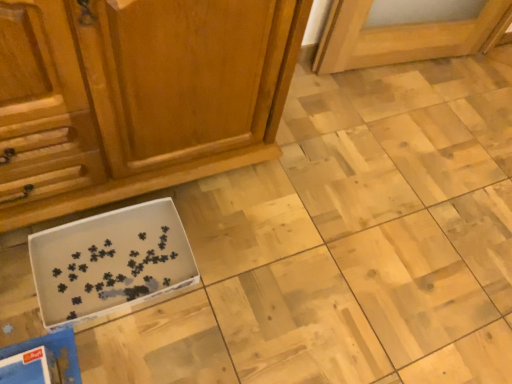
Question: Considering the positions of wooden cabinet at lower left and white cardboard box at lower left in the image, is wooden cabinet at lower left taller or shorter than white cardboard box at lower left?

Choices:
 (A) tall
 (B) short

Answer: (A)

Question: Considering the relative positions of wooden cabinet at lower left and white cardboard box at lower left in the image provided, is wooden cabinet at lower left to the left or to the right of white cardboard box at lower left?

Choices:
 (A) right
 (B) left

Answer: (A)

Question: Would you say wooden cabinet at lower left is inside or outside white cardboard box at lower left?

Choices:
 (A) inside
 (B) outside

Answer: (B)

Question: In terms of size, does white cardboard box at lower left appear bigger or smaller than wooden cabinet at lower left?

Choices:
 (A) small
 (B) big

Answer: (A)

Question: From a real-world perspective, is white cardboard box at lower left above or below wooden cabinet at lower left?

Choices:
 (A) above
 (B) below

Answer: (B)

Question: Is white cardboard box at lower left inside the boundaries of wooden cabinet at lower left, or outside?

Choices:
 (A) inside
 (B) outside

Answer: (B)

Question: Considering their positions, is white cardboard box at lower left located in front of or behind wooden cabinet at lower left?

Choices:
 (A) behind
 (B) front

Answer: (A)